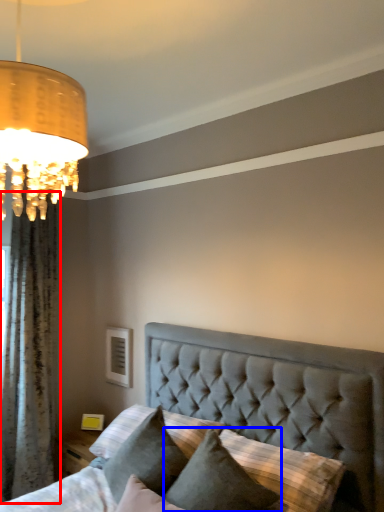
Question: Which of the following is the closest to the observer, curtain (highlighted by a red box) or pillow (highlighted by a blue box)?

Choices:
 (A) curtain
 (B) pillow

Answer: (B)